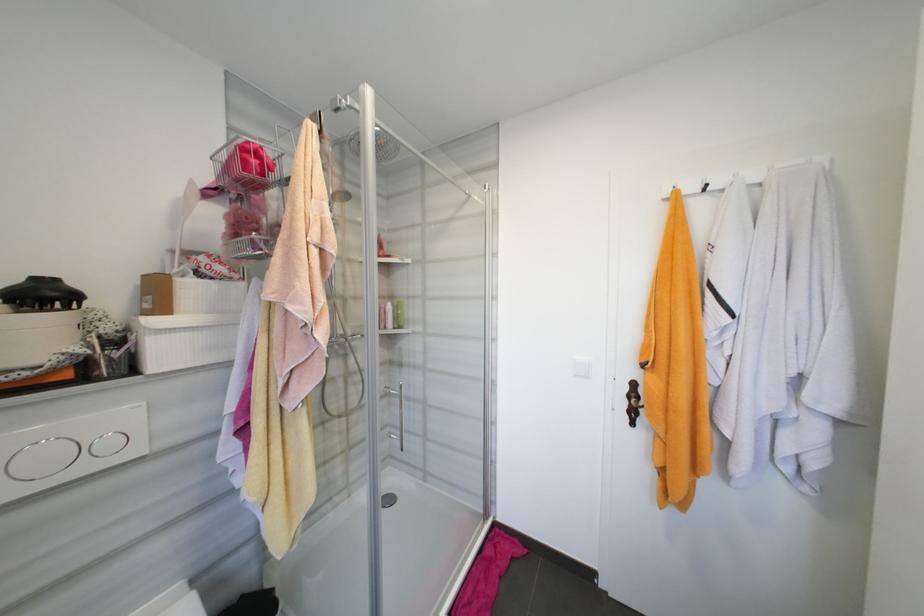
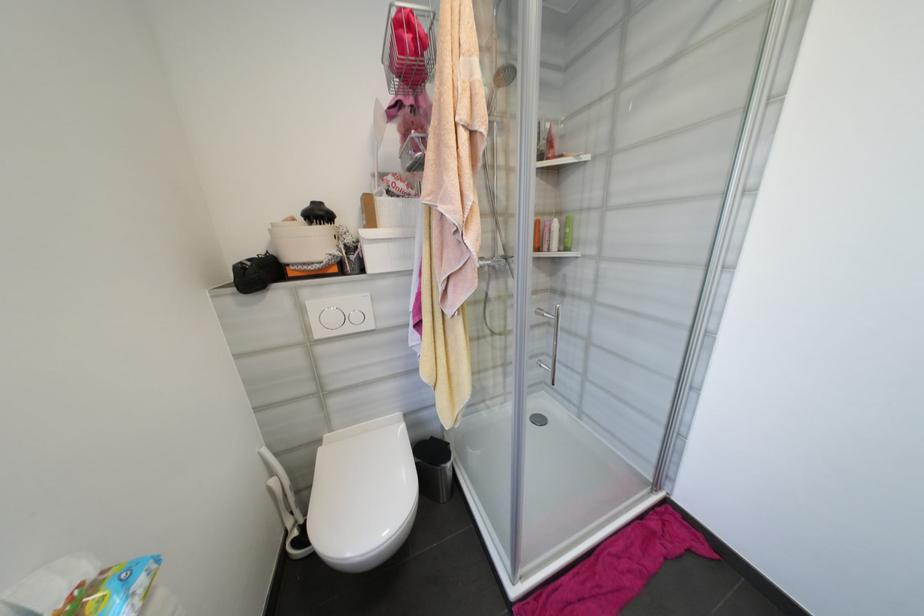
The point at (115, 445) is marked in the first image. Where is the corresponding point in the second image?

(361, 318)